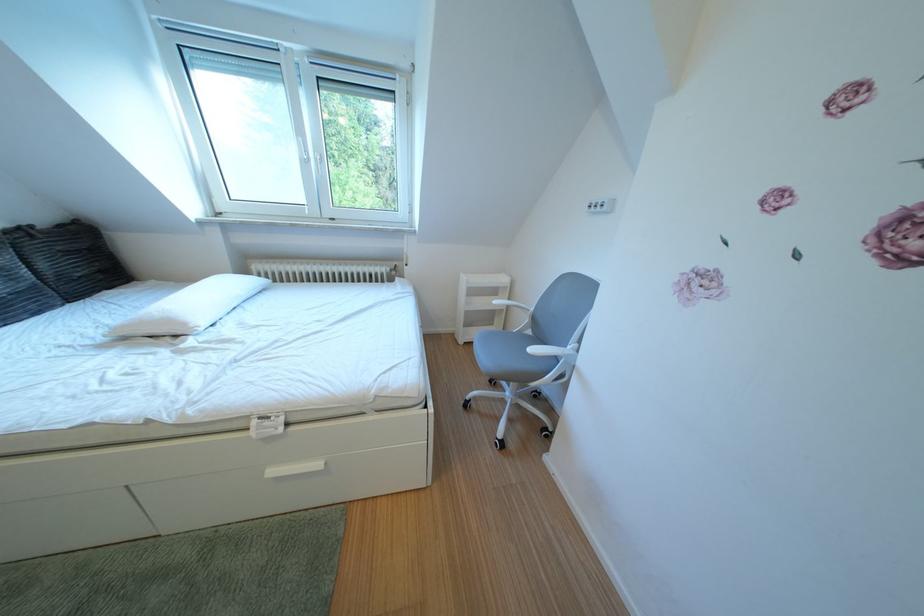
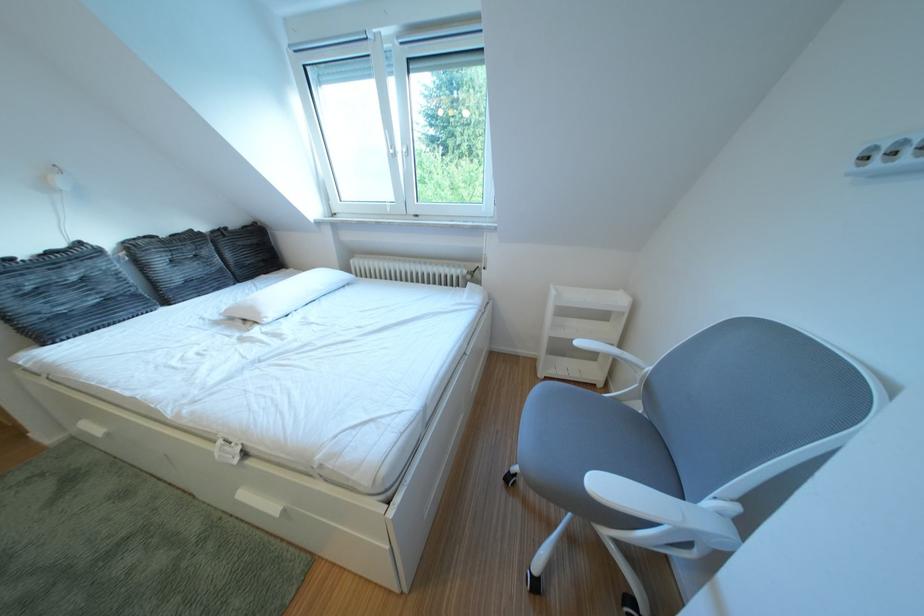
The point at (199, 330) is marked in the first image. Where is the corresponding point in the second image?

(273, 318)